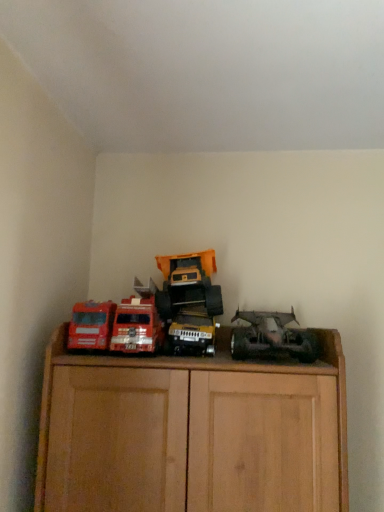
Question: Can rusty metal truck at right, which appears as the 1th toy when viewed from the right, be found inside metallic red fire truck at left, the 2th toy viewed from the left?

Choices:
 (A) no
 (B) yes

Answer: (A)

Question: Would you say metallic red fire truck at left, the third toy when ordered from right to left, is outside rusty metal truck at right, which appears as the 1th toy when viewed from the right?

Choices:
 (A) yes
 (B) no

Answer: (A)

Question: Does metallic red fire truck at left, the third toy when ordered from right to left, come behind rusty metal truck at right, acting as the fourth toy starting from the left?

Choices:
 (A) no
 (B) yes

Answer: (B)

Question: Considering the relative positions of metallic red fire truck at left, the 2th toy viewed from the left, and rusty metal truck at right, acting as the fourth toy starting from the left, in the image provided, is metallic red fire truck at left, the 2th toy viewed from the left, in front of rusty metal truck at right, acting as the fourth toy starting from the left,?

Choices:
 (A) yes
 (B) no

Answer: (B)

Question: Does metallic red fire truck at left, the third toy when ordered from right to left, have a smaller size compared to rusty metal truck at right, acting as the fourth toy starting from the left?

Choices:
 (A) yes
 (B) no

Answer: (A)

Question: From a real-world perspective, is metallic yellow truck at center, the 3th toy in the left-to-right sequence, above or below matte red truck at left, which is the 1th toy from left to right?

Choices:
 (A) below
 (B) above

Answer: (A)

Question: In the image, is metallic yellow truck at center, the 3th toy in the left-to-right sequence, on the left side or the right side of matte red truck at left, the fourth toy viewed from the right?

Choices:
 (A) right
 (B) left

Answer: (A)

Question: Is metallic yellow truck at center, the 3th toy in the left-to-right sequence, taller or shorter than matte red truck at left, which is the 1th toy from left to right?

Choices:
 (A) tall
 (B) short

Answer: (B)

Question: Based on their sizes in the image, would you say metallic yellow truck at center, the 3th toy in the left-to-right sequence, is bigger or smaller than matte red truck at left, which is the 1th toy from left to right?

Choices:
 (A) small
 (B) big

Answer: (B)

Question: From a real-world perspective, is matte red truck at left, which is the 1th toy from left to right, above or below metallic yellow truck at center, the 3th toy in the left-to-right sequence?

Choices:
 (A) above
 (B) below

Answer: (A)

Question: Considering the positions of matte red truck at left, which is the 1th toy from left to right, and metallic yellow truck at center, acting as the 2th toy starting from the right, in the image, is matte red truck at left, which is the 1th toy from left to right, taller or shorter than metallic yellow truck at center, acting as the 2th toy starting from the right,?

Choices:
 (A) short
 (B) tall

Answer: (B)

Question: Is matte red truck at left, the fourth toy viewed from the right, inside the boundaries of metallic yellow truck at center, acting as the 2th toy starting from the right, or outside?

Choices:
 (A) outside
 (B) inside

Answer: (A)

Question: Is matte red truck at left, which is the 1th toy from left to right, to the left or to the right of metallic yellow truck at center, acting as the 2th toy starting from the right, in the image?

Choices:
 (A) left
 (B) right

Answer: (A)

Question: Do you think metallic red fire truck at left, the third toy when ordered from right to left, is within matte red truck at left, the fourth toy viewed from the right, or outside of it?

Choices:
 (A) outside
 (B) inside

Answer: (A)

Question: From a real-world perspective, relative to matte red truck at left, the fourth toy viewed from the right, is metallic red fire truck at left, the third toy when ordered from right to left, vertically above or below?

Choices:
 (A) above
 (B) below

Answer: (A)